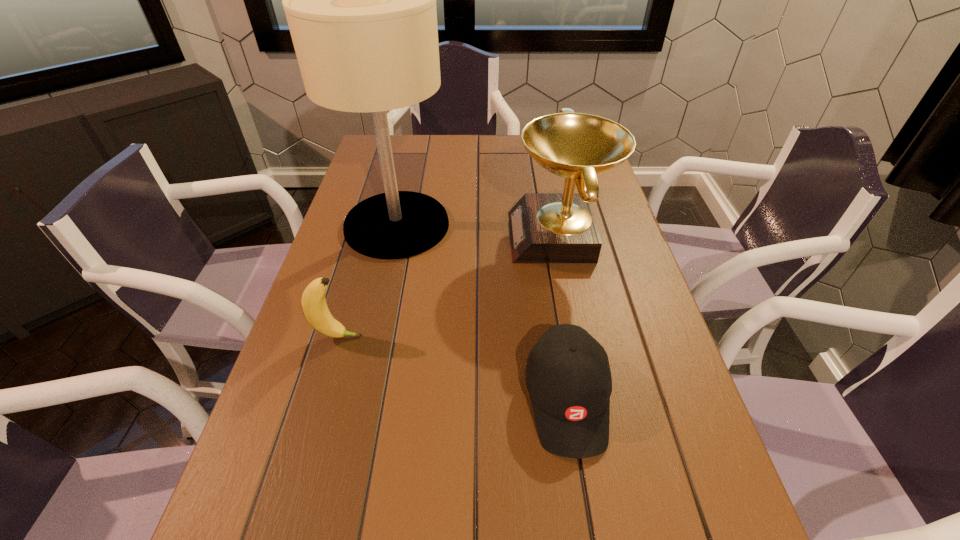
Locate an element on the screen. This screenshot has height=540, width=960. vacant point located between the tallest object and the third shortest object is located at coordinates (478, 231).

Find the location of a particular element. The image size is (960, 540). vacant region between the baseball cap and the third shortest object is located at coordinates (564, 318).

At what (x,y) coordinates should I click in order to perform the action: click on free space between the second tallest object and the tallest object. Please return your answer as a coordinate pair (x, y). This screenshot has height=540, width=960. Looking at the image, I should click on (478, 231).

At what (x,y) coordinates should I click in order to perform the action: click on vacant region between the second nearest object and the award. Please return your answer as a coordinate pair (x, y). The height and width of the screenshot is (540, 960). Looking at the image, I should click on (449, 287).

Where is `free area in between the nearest object and the table lamp`? Image resolution: width=960 pixels, height=540 pixels. free area in between the nearest object and the table lamp is located at coordinates (482, 312).

Locate an element on the screen. vacant space that is in between the third tallest object and the shortest object is located at coordinates (452, 368).

The image size is (960, 540). I want to click on free space that is in between the table lamp and the third tallest object, so click(x=368, y=281).

The height and width of the screenshot is (540, 960). I want to click on the third closest object to the third farthest object, so [544, 227].

The width and height of the screenshot is (960, 540). In order to click on the closest object to the shortest object in this screenshot , I will do `click(544, 227)`.

Locate an element on the screen. vacant space that satisfies the following two spatial constraints: 1. on the front-facing side of the award; 2. with a logo on the front of the shortest object is located at coordinates (593, 399).